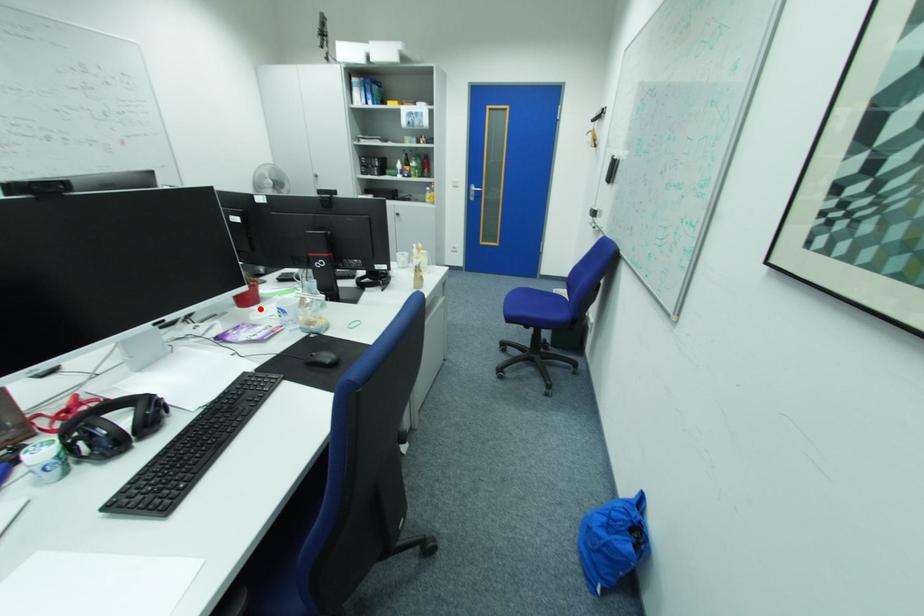
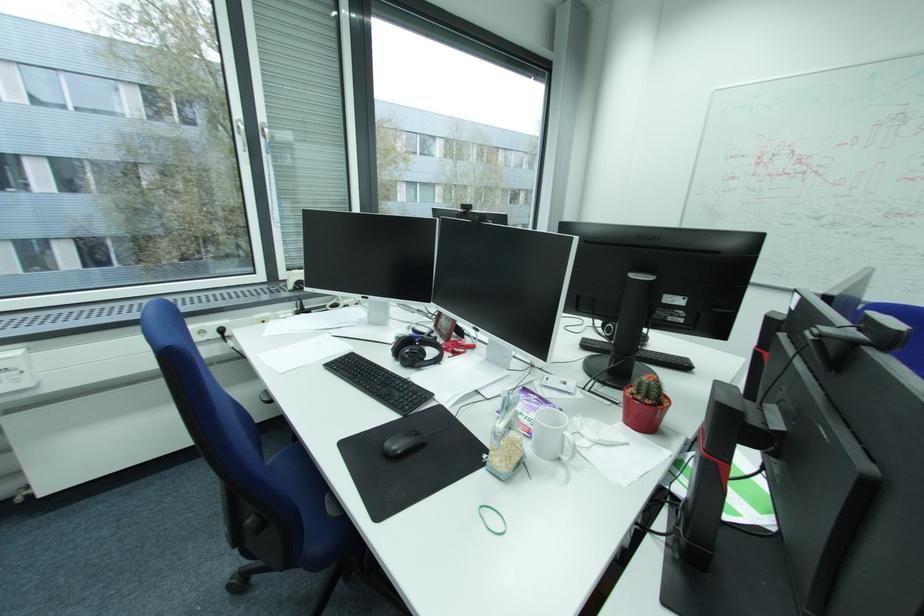
In the second image, find the point that corresponds to the highlighted location in the first image.

(629, 424)